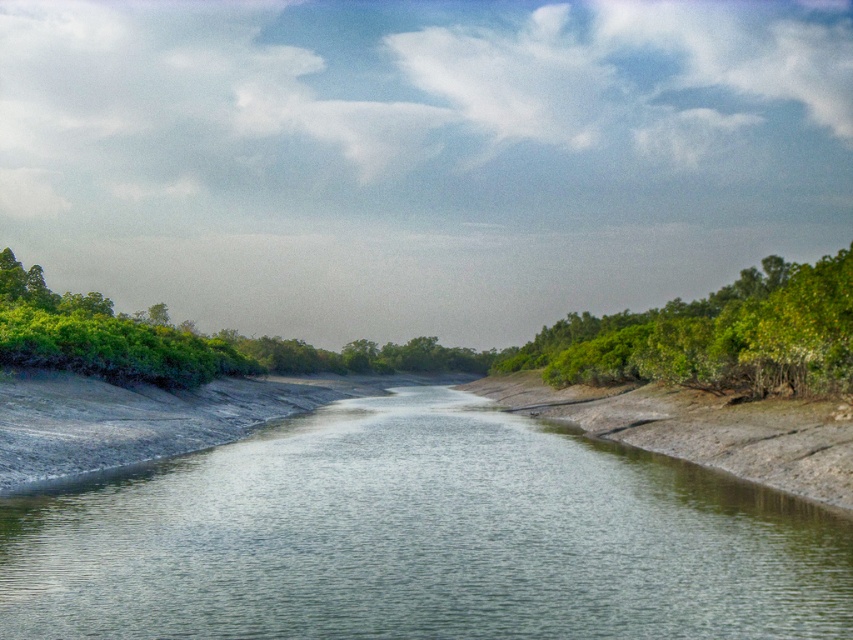
You are standing at the edge of the river and see two points marked on the river surface. The first point is at coordinates point (833, 285) and the second point is at point (4, 278). Which point is closer to you?

Point (833, 285) is closer to the camera than point (4, 278), so the first point is closer to you.

You are a hiker trying to cross the river using a small wooden bridge. The bridge can only support objects that are smaller than the green leafy shrub at left. Can the green leafy trees at right safely cross the bridge?

The green leafy trees at right has a smaller size compared to green leafy shrub at left, so yes, the green leafy trees at right can safely cross the bridge since they are smaller than the shrub.